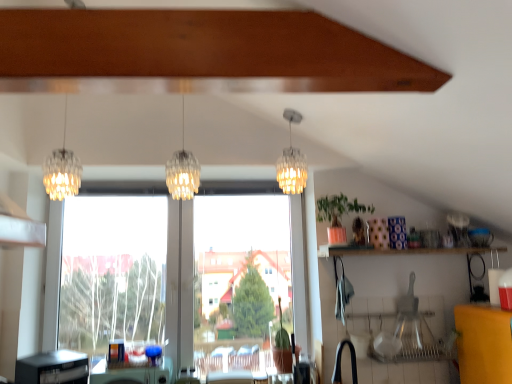
At what (x,y) coordinates should I click in order to perform the action: click on clear glass chandelier at center, the first lamp in the right-to-left sequence. Please return your answer as a coordinate pair (x, y). Image resolution: width=512 pixels, height=384 pixels. Looking at the image, I should click on (292, 161).

This screenshot has width=512, height=384. What do you see at coordinates (338, 214) in the screenshot?
I see `green matte plant at upper right` at bounding box center [338, 214].

Identify the location of black plastic dishwasher at lower left. This screenshot has height=384, width=512. (53, 368).

Is translucent glass chandelier at left, the 1th lamp from the left, next to clear glass chandelier at center, the first lamp in the right-to-left sequence, and touching it?

No.

From a real-world perspective, does translucent glass chandelier at left, the 3th lamp from the right, stand above clear glass chandelier at center, positioned as the 3th lamp in left-to-right order?

Yes, from a real-world perspective, translucent glass chandelier at left, the 3th lamp from the right, is over clear glass chandelier at center, positioned as the 3th lamp in left-to-right order

Is translucent glass chandelier at left, the 1th lamp from the left, taller or shorter than clear glass chandelier at center, the first lamp in the right-to-left sequence?

Clearly, translucent glass chandelier at left, the 1th lamp from the left, is taller compared to clear glass chandelier at center, the first lamp in the right-to-left sequence.

From the image's perspective, which one is positioned lower, translucent glass chandelier at left, the 1th lamp from the left, or clear glass chandelier at center, positioned as the 3th lamp in left-to-right order?

clear glass chandelier at center, positioned as the 3th lamp in left-to-right order, appears lower in the image.

From the picture: Is green matte plant at upper right facing towards black plastic dishwasher at lower left?

No, green matte plant at upper right is not turned towards black plastic dishwasher at lower left.

Identify the location of houseplant above the black plastic dishwasher at lower left (from the image's perspective). This screenshot has width=512, height=384. (338, 214).

Based on their sizes in the image, would you say green matte plant at upper right is bigger or smaller than black plastic dishwasher at lower left?

Clearly, green matte plant at upper right is smaller in size than black plastic dishwasher at lower left.

Is point (341, 224) closer to viewer compared to point (74, 372)?

No.

How far apart are black rubber faucet at lower center and black plastic dishwasher at lower left?

5.17 feet.

Is the surface of black rubber faucet at lower center in direct contact with black plastic dishwasher at lower left?

black rubber faucet at lower center is not next to black plastic dishwasher at lower left, and they're not touching.

From the image's perspective, is black rubber faucet at lower center on top of black plastic dishwasher at lower left?

Indeed, from the image's perspective, black rubber faucet at lower center is shown above black plastic dishwasher at lower left.

Considering the relative positions of black plastic dishwasher at lower left and black rubber faucet at lower center in the image provided, is black plastic dishwasher at lower left to the left of black rubber faucet at lower center from the viewer's perspective?

Indeed, black plastic dishwasher at lower left is positioned on the left side of black rubber faucet at lower center.

From their relative heights in the image, would you say black plastic dishwasher at lower left is taller or shorter than black rubber faucet at lower center?

Considering their sizes, black plastic dishwasher at lower left has less height than black rubber faucet at lower center.

From the image's perspective, which one is positioned lower, black plastic dishwasher at lower left or black rubber faucet at lower center?

black plastic dishwasher at lower left is shown below in the image.

Is black rubber faucet at lower center bigger or smaller than translucent glass chandelier at left, the 3th lamp from the right?

In the image, black rubber faucet at lower center appears to be smaller than translucent glass chandelier at left, the 3th lamp from the right.

Which object is positioned more to the left, black rubber faucet at lower center or translucent glass chandelier at left, the 3th lamp from the right?

translucent glass chandelier at left, the 3th lamp from the right.

From the image's perspective, which one is positioned higher, black rubber faucet at lower center or translucent glass chandelier at left, the 3th lamp from the right?

translucent glass chandelier at left, the 3th lamp from the right, is shown above in the image.

Image resolution: width=512 pixels, height=384 pixels. I want to click on dish washer in front of the transparent glass window at center, so click(53, 368).

Considering the relative sizes of black plastic dishwasher at lower left and transparent glass window at center in the image provided, is black plastic dishwasher at lower left bigger than transparent glass window at center?

Incorrect, black plastic dishwasher at lower left is not larger than transparent glass window at center.

In the scene shown: Is black plastic dishwasher at lower left far away from transparent glass window at center?

Actually, black plastic dishwasher at lower left and transparent glass window at center are a little close together.

Is black plastic dishwasher at lower left aimed at transparent glass window at center?

No, black plastic dishwasher at lower left is not aimed at transparent glass window at center.

In the scene shown: From the image's perspective, which one is positioned higher, translucent glass pendant light at center, which is the 2th lamp in right-to-left order, or clear glass chandelier at center, positioned as the 3th lamp in left-to-right order?

translucent glass pendant light at center, which is the 2th lamp in right-to-left order, from the image's perspective.

Is point (178, 191) closer to camera compared to point (293, 189)?

Yes, it is.

Relative to clear glass chandelier at center, the first lamp in the right-to-left sequence, is translucent glass pendant light at center, which is the 2th lamp in right-to-left order, in front or behind?

Clearly, translucent glass pendant light at center, which is the 2th lamp in right-to-left order, is in front of clear glass chandelier at center, the first lamp in the right-to-left sequence.

Consider the image. Is translucent glass pendant light at center, which is the 2th lamp in right-to-left order, spatially inside clear glass chandelier at center, positioned as the 3th lamp in left-to-right order, or outside of it?

translucent glass pendant light at center, which is the 2th lamp in right-to-left order, is spatially situated outside clear glass chandelier at center, positioned as the 3th lamp in left-to-right order.

Identify the location of lamp that is the 2nd object located in front of the clear glass chandelier at center, positioned as the 3th lamp in left-to-right order. The width and height of the screenshot is (512, 384). (62, 170).

Identify the location of dish washer on the left of green matte plant at upper right. (53, 368).

From the image, which object appears to be nearer to green plastic table at lower center, black rubber faucet at lower center or translucent glass chandelier at left, the 1th lamp from the left?

Based on the image, translucent glass chandelier at left, the 1th lamp from the left, appears to be nearer to green plastic table at lower center.

From the image, which object appears to be nearer to translucent glass pendant light at center, acting as the 2th lamp starting from the left, clear glass chandelier at center, the first lamp in the right-to-left sequence, or black plastic dishwasher at lower left?

Based on the image, clear glass chandelier at center, the first lamp in the right-to-left sequence, appears to be nearer to translucent glass pendant light at center, acting as the 2th lamp starting from the left.

In the scene shown: Estimate the real-world distances between objects in this image. Which object is closer to black plastic dishwasher at lower left, green plastic table at lower center or translucent glass chandelier at left, the 3th lamp from the right?

green plastic table at lower center lies closer to black plastic dishwasher at lower left than the other object.

Based on their spatial positions, is translucent glass chandelier at left, the 1th lamp from the left, or clear glass chandelier at center, positioned as the 3th lamp in left-to-right order, closer to transparent glass window at center?

translucent glass chandelier at left, the 1th lamp from the left, lies closer to transparent glass window at center than the other object.

Looking at this image, estimate the real-world distances between objects in this image. Which object is further from green plastic table at lower center, transparent glass window at center or black plastic dishwasher at lower left?

Based on the image, transparent glass window at center appears to be further to green plastic table at lower center.

Looking at this image, based on their spatial positions, is transparent glass window at center or translucent glass pendant light at center, which is the 2th lamp in right-to-left order, closer to black plastic dishwasher at lower left?

transparent glass window at center lies closer to black plastic dishwasher at lower left than the other object.

Looking at the image, which one is located closer to green matte plant at upper right, translucent glass chandelier at left, the 1th lamp from the left, or black plastic dishwasher at lower left?

The object closer to green matte plant at upper right is translucent glass chandelier at left, the 1th lamp from the left.

Estimate the real-world distances between objects in this image. Which object is closer to green plastic table at lower center, clear glass chandelier at center, the first lamp in the right-to-left sequence, or green matte plant at upper right?

green matte plant at upper right.

This screenshot has width=512, height=384. In order to click on window between translucent glass pendant light at center, acting as the 2th lamp starting from the left, and green plastic table at lower center, in the vertical direction in this screenshot , I will do `click(174, 269)`.

Locate an element on the screen. The image size is (512, 384). dish washer between translucent glass pendant light at center, which is the 2th lamp in right-to-left order, and green plastic table at lower center from top to bottom is located at coordinates (53, 368).

Where is `window between clear glass chandelier at center, positioned as the 3th lamp in left-to-right order, and black rubber faucet at lower center in the up-down direction`? This screenshot has height=384, width=512. window between clear glass chandelier at center, positioned as the 3th lamp in left-to-right order, and black rubber faucet at lower center in the up-down direction is located at coordinates (174, 269).

The image size is (512, 384). I want to click on dish washer between clear glass chandelier at center, positioned as the 3th lamp in left-to-right order, and green plastic table at lower center in the up-down direction, so click(x=53, y=368).